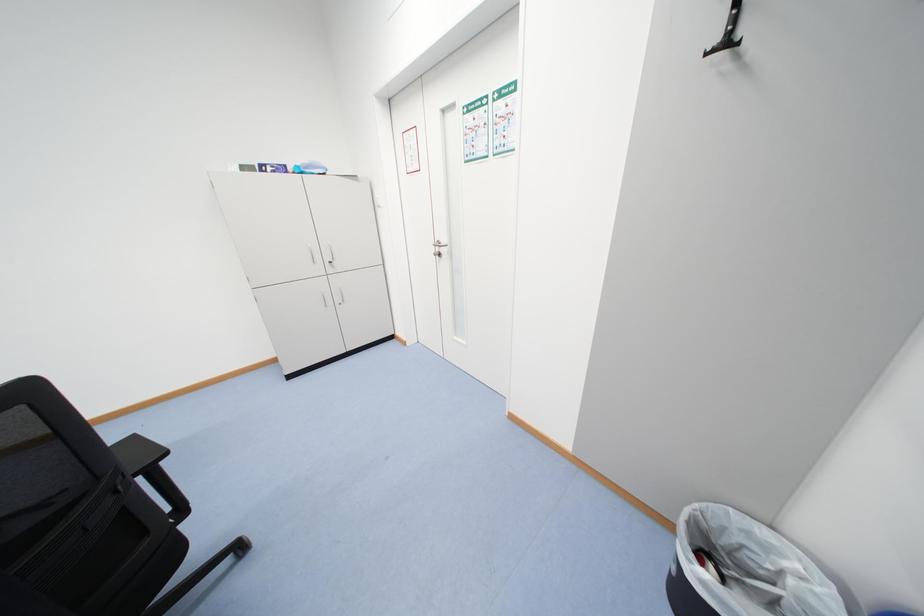
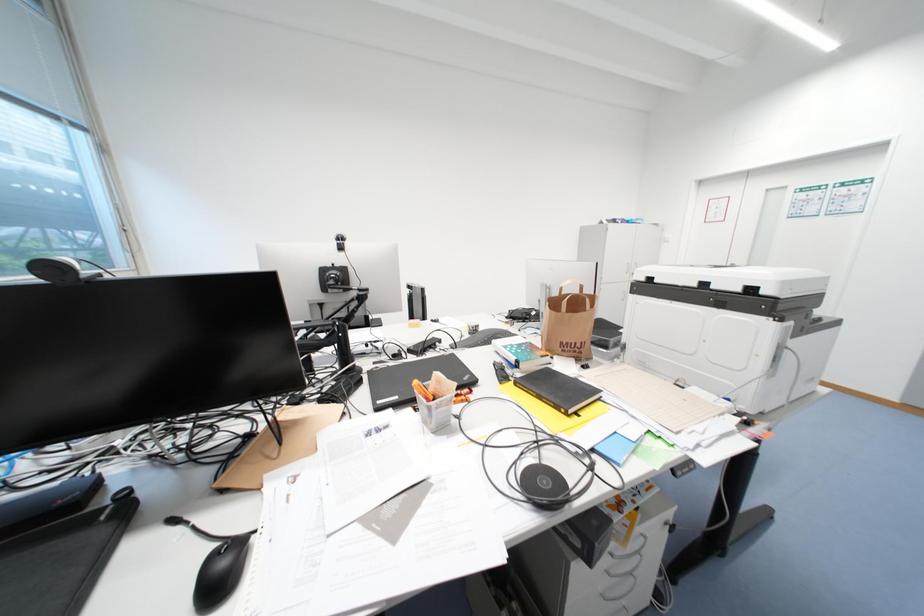
Which direction would the cameraman need to move to produce the second image?

The cameraman walked toward left, backward.